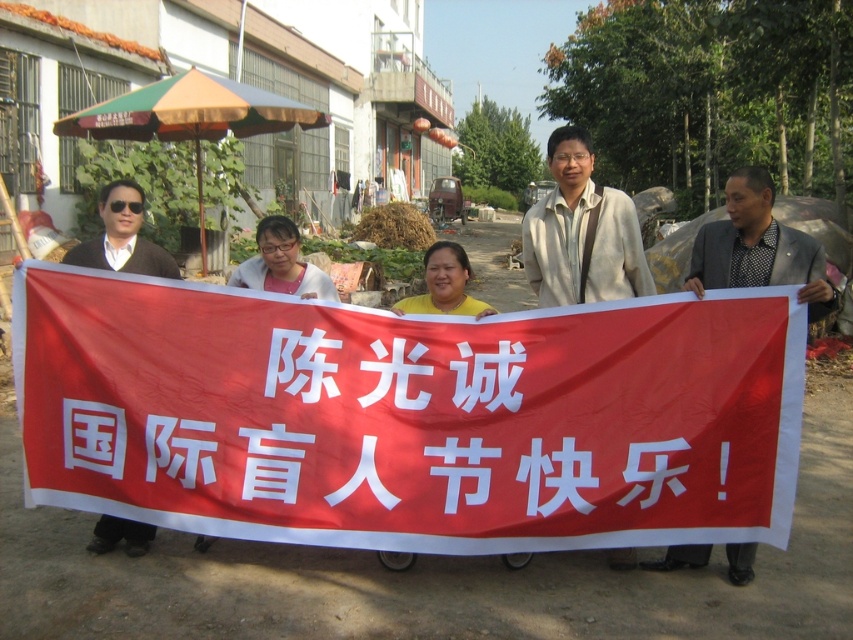
Question: Based on their relative distances, which object is nearer to the red fabric banner at center?

Choices:
 (A) beige fabric shirt at center
 (B) matte beige jacket at center
 (C) yellow matte shirt at center
 (D) matte white shirt at center

Answer: (C)

Question: Which object is positioned closest to the yellow matte shirt at center?

Choices:
 (A) matte white shirt at center
 (B) matte beige jacket at center
 (C) dark gray suit at right
 (D) matte black shirt at left

Answer: (B)

Question: Is red fabric banner at center below dark gray suit at right?

Choices:
 (A) yes
 (B) no

Answer: (A)

Question: Is dark gray suit at right closer to the viewer compared to matte white shirt at center?

Choices:
 (A) yes
 (B) no

Answer: (A)

Question: Does matte beige jacket at center come in front of matte white shirt at center?

Choices:
 (A) yes
 (B) no

Answer: (A)

Question: Which point is closer to the camera taking this photo?

Choices:
 (A) [x=113, y=246]
 (B) [x=386, y=320]

Answer: (B)